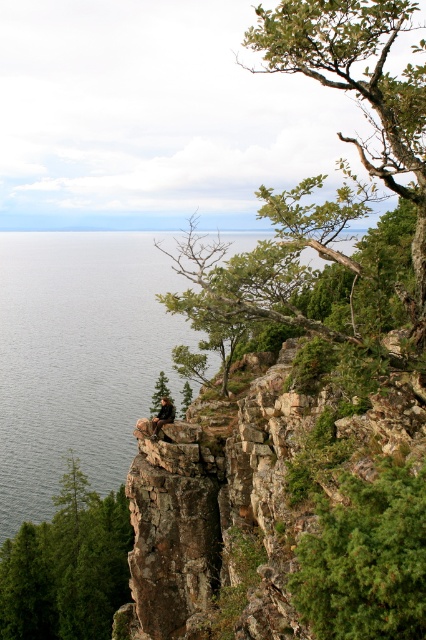
Is green leafy tree at upper right to the right of green matte tree at center from the viewer's perspective?

Indeed, green leafy tree at upper right is positioned on the right side of green matte tree at center.

Who is positioned more to the left, green leafy tree at upper right or green matte tree at center?

From the viewer's perspective, green matte tree at center appears more on the left side.

You are a GUI agent. You are given a task and a screenshot of the screen. Output one action in this format:
    pyautogui.click(x=<x>, y=<y>)
    Task: Click on the green leafy tree at upper right
    The height and width of the screenshot is (640, 426).
    Given the screenshot: What is the action you would take?
    pyautogui.click(x=360, y=97)

Which is below, green rough bark tree at lower left or camouflage fabric person at center?

green rough bark tree at lower left

Consider the image. Can you confirm if green rough bark tree at lower left is smaller than camouflage fabric person at center?

Incorrect, green rough bark tree at lower left is not smaller in size than camouflage fabric person at center.

The height and width of the screenshot is (640, 426). What do you see at coordinates (68, 566) in the screenshot? I see `green rough bark tree at lower left` at bounding box center [68, 566].

The width and height of the screenshot is (426, 640). Identify the location of green rough bark tree at lower left. (68, 566).

Measure the distance between green water at lower left and green leafy tree at upper right.

A distance of 61.85 meters exists between green water at lower left and green leafy tree at upper right.

Is green water at lower left further to camera compared to green leafy tree at upper right?

Yes, green water at lower left is further from the viewer.

In order to click on green water at lower left in this screenshot , I will do `click(78, 356)`.